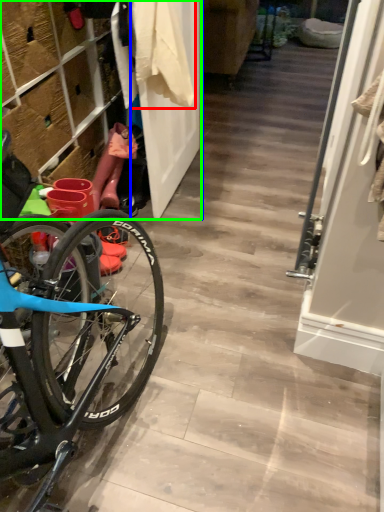
Question: Based on their relative distances, which object is farther from clothing (highlighted by a red box)? Choose from door (highlighted by a blue box) and closet (highlighted by a green box).

Choices:
 (A) door
 (B) closet

Answer: (B)